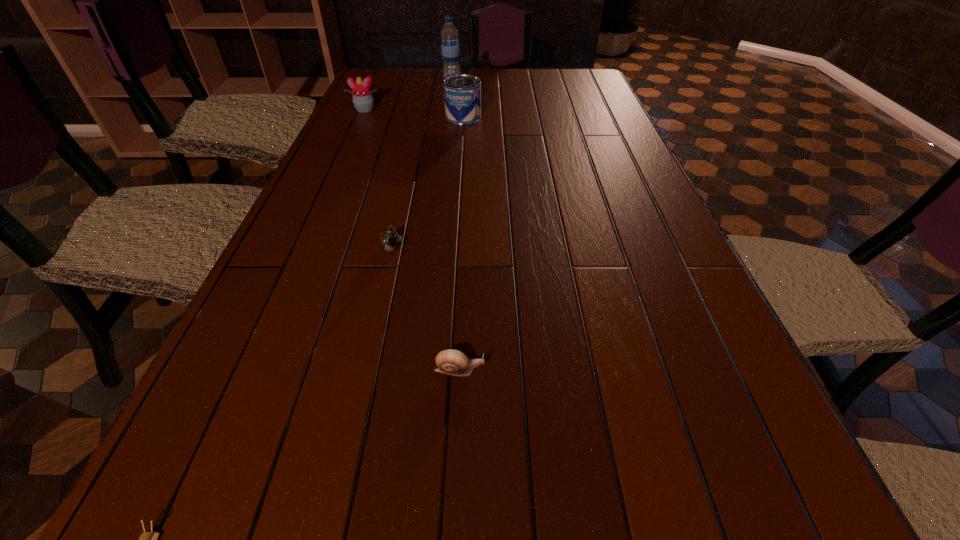
I want to click on free space located 0.230m on the face of the cupcake, so click(348, 147).

The width and height of the screenshot is (960, 540). I want to click on free space located 0.170m on the face of the tallest escargot, so click(375, 325).

I want to click on free space located 0.300m on the front-facing side of the rightmost escargot, so (x=660, y=370).

You are a GUI agent. You are given a task and a screenshot of the screen. Output one action in this format:
    pyautogui.click(x=<x>, y=<y>)
    Task: Click on the object that is at the far edge
    
    Given the screenshot: What is the action you would take?
    pyautogui.click(x=450, y=50)

Locate an element on the screen. object that is at the left edge is located at coordinates (363, 100).

Locate an element on the screen. free space at the far edge of the desktop is located at coordinates (437, 80).

Where is `blank area at the left edge`? The height and width of the screenshot is (540, 960). blank area at the left edge is located at coordinates (326, 169).

This screenshot has height=540, width=960. What are the coordinates of `vacant space at the right edge of the desktop` in the screenshot? It's located at point(601,114).

You are a GUI agent. You are given a task and a screenshot of the screen. Output one action in this format:
    pyautogui.click(x=<x>, y=<y>)
    Task: Click on the vacant space at the far right corner of the desktop
    
    Given the screenshot: What is the action you would take?
    pyautogui.click(x=557, y=78)

Locate an element on the screen. This screenshot has width=960, height=540. vacant point located between the second tallest escargot and the can is located at coordinates (461, 244).